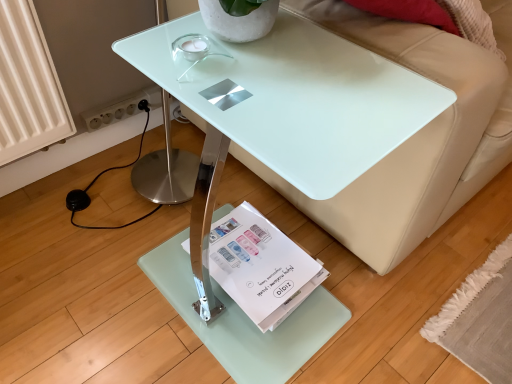
Question: Can you confirm if transparent glass table at center is taller than beige leather couch at upper right?

Choices:
 (A) no
 (B) yes

Answer: (A)

Question: Is transparent glass table at center facing away from beige leather couch at upper right?

Choices:
 (A) no
 (B) yes

Answer: (A)

Question: Are transparent glass table at center and beige leather couch at upper right located far from each other?

Choices:
 (A) yes
 (B) no

Answer: (B)

Question: Is transparent glass table at center bigger than beige leather couch at upper right?

Choices:
 (A) yes
 (B) no

Answer: (B)

Question: Is transparent glass table at center oriented towards beige leather couch at upper right?

Choices:
 (A) no
 (B) yes

Answer: (A)

Question: From the image's perspective, is transparent glass table at center above or below white paper magazine at lower center?

Choices:
 (A) below
 (B) above

Answer: (B)

Question: Does point (268, 165) appear closer or farther from the camera than point (274, 269)?

Choices:
 (A) closer
 (B) farther

Answer: (A)

Question: Would you say transparent glass table at center is to the left or to the right of white paper magazine at lower center in the picture?

Choices:
 (A) left
 (B) right

Answer: (B)

Question: From their relative heights in the image, would you say transparent glass table at center is taller or shorter than white paper magazine at lower center?

Choices:
 (A) short
 (B) tall

Answer: (B)

Question: From a real-world perspective, is white paper magazine at lower center positioned above or below beige leather couch at upper right?

Choices:
 (A) below
 (B) above

Answer: (A)

Question: Is point (253, 248) closer or farther from the camera than point (390, 180)?

Choices:
 (A) closer
 (B) farther

Answer: (B)

Question: From the image's perspective, is white paper magazine at lower center above or below beige leather couch at upper right?

Choices:
 (A) above
 (B) below

Answer: (B)

Question: In terms of width, does white paper magazine at lower center look wider or thinner when compared to beige leather couch at upper right?

Choices:
 (A) wide
 (B) thin

Answer: (B)

Question: Is beige leather couch at upper right inside the boundaries of white paper magazine at lower center, or outside?

Choices:
 (A) inside
 (B) outside

Answer: (B)

Question: Is beige leather couch at upper right wider or thinner than white paper magazine at lower center?

Choices:
 (A) wide
 (B) thin

Answer: (A)